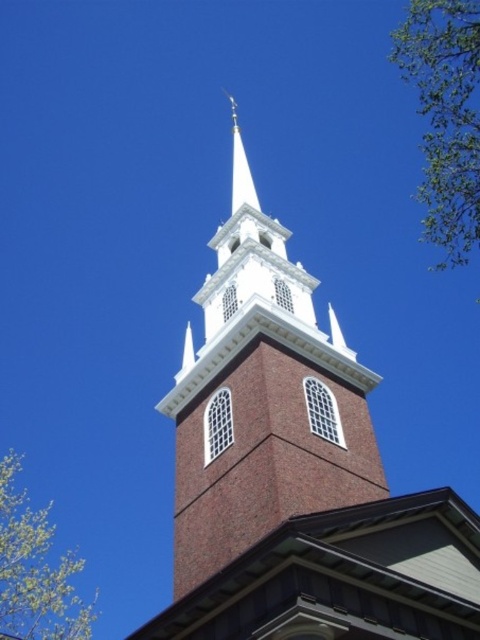
Looking at this image, who is positioned more to the left, brick steeple at center or green leafy tree at upper left?

From the viewer's perspective, green leafy tree at upper left appears more on the left side.

Can you confirm if brick steeple at center is bigger than green leafy tree at upper left?

No.

Between point (227, 296) and point (78, 602), which one is positioned in front?

Point (227, 296) is more forward.

This screenshot has width=480, height=640. Identify the location of brick steeple at center. (263, 404).

Is point (313, 440) in front of point (422, 234)?

Yes, it is in front of point (422, 234).

Does brick steeple at center come behind green leafy tree at upper right?

No, it is in front of green leafy tree at upper right.

Does point (309, 289) come farther from viewer compared to point (472, 177)?

Yes, it is behind point (472, 177).

Locate an element on the screen. The height and width of the screenshot is (640, 480). brick steeple at center is located at coordinates (263, 404).

Between green leafy tree at upper left and white smooth steeple at upper center, which one has less height?

With less height is white smooth steeple at upper center.

Between point (24, 602) and point (245, 172), which one is positioned behind?

Point (24, 602)

This screenshot has height=640, width=480. Identify the location of green leafy tree at upper left. (35, 570).